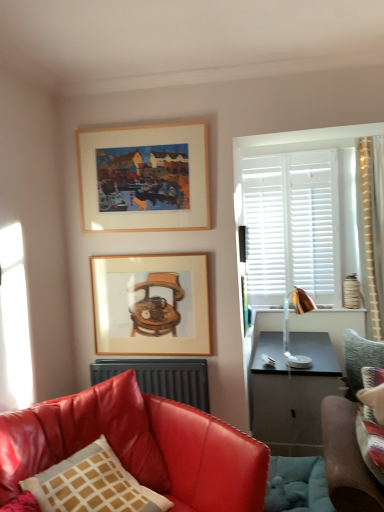
Find the location of `blank space situated above dark gray metallic radiator at lower center (from a real-world perspective)`. blank space situated above dark gray metallic radiator at lower center (from a real-world perspective) is located at coordinates (151, 355).